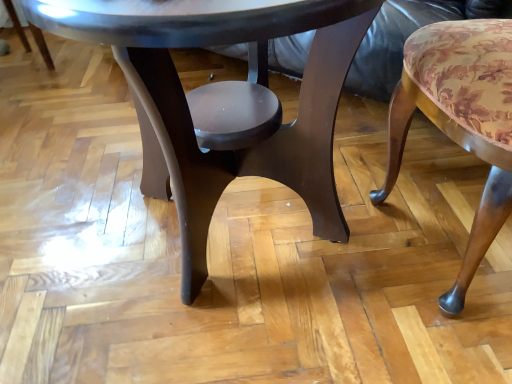
Question: Can you confirm if glossy dark wood coffee table at center is smaller than floral fabric cushion at right?

Choices:
 (A) yes
 (B) no

Answer: (B)

Question: Considering the relative sizes of glossy dark wood coffee table at center and floral fabric cushion at right in the image provided, is glossy dark wood coffee table at center shorter than floral fabric cushion at right?

Choices:
 (A) yes
 (B) no

Answer: (B)

Question: Could floral fabric cushion at right be considered to be inside glossy dark wood coffee table at center?

Choices:
 (A) no
 (B) yes

Answer: (A)

Question: Is glossy dark wood coffee table at center at the left side of floral fabric cushion at right?

Choices:
 (A) no
 (B) yes

Answer: (B)

Question: Is glossy dark wood coffee table at center touching floral fabric cushion at right?

Choices:
 (A) no
 (B) yes

Answer: (A)

Question: From a real-world perspective, is glossy dark wood coffee table at center physically above floral fabric cushion at right?

Choices:
 (A) yes
 (B) no

Answer: (A)

Question: Is floral fabric cushion at right behind glossy dark wood coffee table at center?

Choices:
 (A) yes
 (B) no

Answer: (A)

Question: Is glossy dark wood coffee table at center a part of floral fabric cushion at right?

Choices:
 (A) no
 (B) yes

Answer: (A)

Question: From the image's perspective, would you say floral fabric cushion at right is shown under glossy dark wood coffee table at center?

Choices:
 (A) no
 (B) yes

Answer: (B)

Question: Is floral fabric cushion at right located outside glossy dark wood coffee table at center?

Choices:
 (A) no
 (B) yes

Answer: (B)

Question: Is floral fabric cushion at right taller than glossy dark wood coffee table at center?

Choices:
 (A) yes
 (B) no

Answer: (B)

Question: Is floral fabric cushion at right wider than glossy dark wood coffee table at center?

Choices:
 (A) yes
 (B) no

Answer: (B)

Question: Does point (415, 31) appear closer or farther from the camera than point (313, 196)?

Choices:
 (A) closer
 (B) farther

Answer: (A)